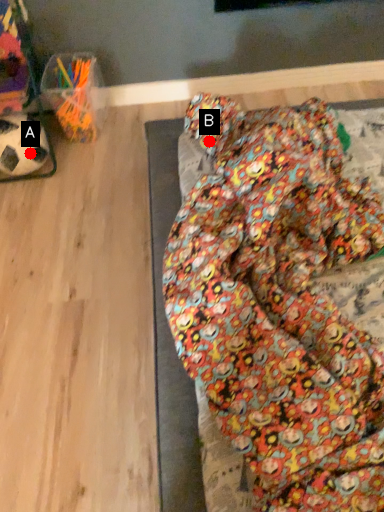
Question: Two points are circled on the image, labeled by A and B beside each circle. Which point is further to the camera?

Choices:
 (A) A is further
 (B) B is further

Answer: (A)